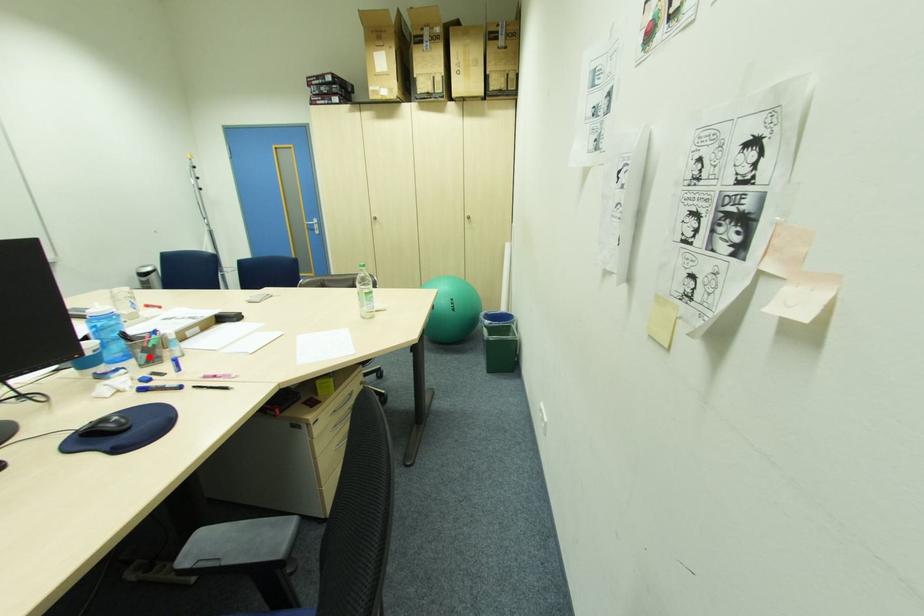
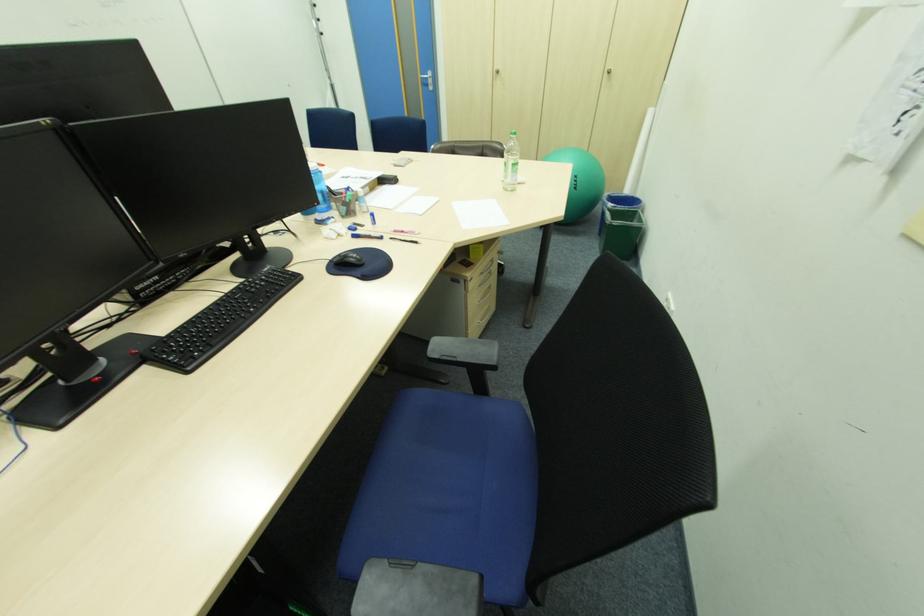
Find the pixel in the second image that matches the highlighted location in the first image.

(349, 209)